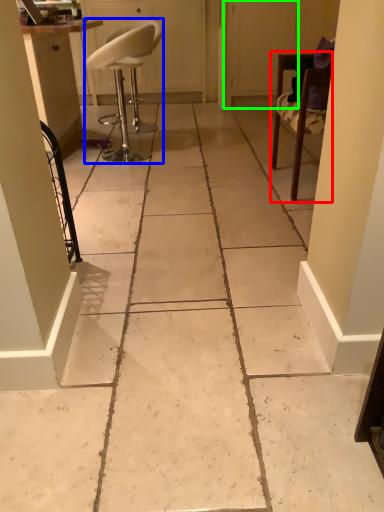
Question: Which object is the closest to the chair (highlighted by a red box)? Choose among these: chair (highlighted by a blue box) or screen door (highlighted by a green box).

Choices:
 (A) chair
 (B) screen door

Answer: (A)